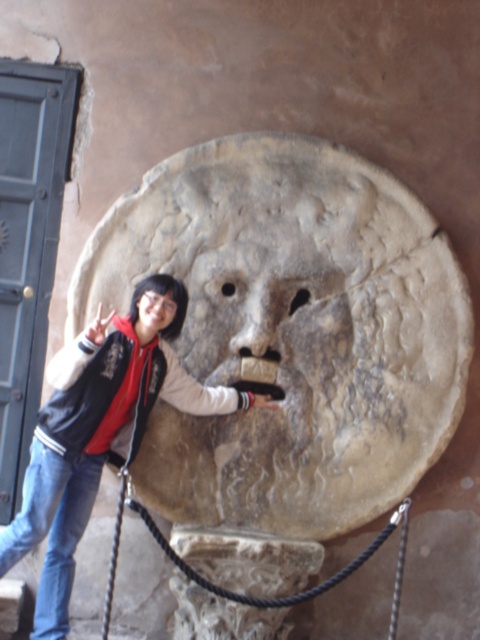
Question: Which of the following is the closest to the observer?

Choices:
 (A) (227, 401)
 (B) (176, 307)

Answer: (B)

Question: Does jeans at lower left appear on the left side of jeans at left?

Choices:
 (A) yes
 (B) no

Answer: (B)

Question: Is jeans at left below matte stone face at center?

Choices:
 (A) no
 (B) yes

Answer: (B)

Question: Estimate the real-world distances between objects in this image. Which object is closer to the jeans at lower left?

Choices:
 (A) matte stone face at center
 (B) gray stone face at center
 (C) jeans at left

Answer: (C)

Question: Which is farther from the gray stone face at center?

Choices:
 (A) jeans at lower left
 (B) matte stone face at center
 (C) jeans at left

Answer: (C)

Question: Is gray stone face at center positioned at the back of jeans at left?

Choices:
 (A) yes
 (B) no

Answer: (A)